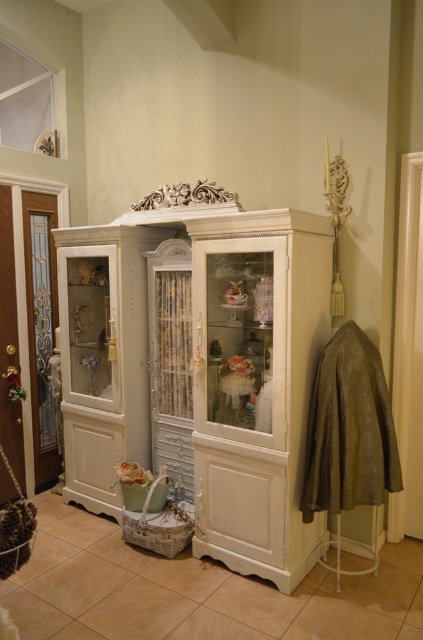
You are standing in the room and want to place a new decorative item on the white glossy cabinet at center. Given that the cabinet is positioned at coordinates approximately 0.580 in the x and 0.478 in the y direction, can you determine its central location relative to the room?

The white glossy cabinet at center is located at point (x=202, y=371), so its central position in the room can be determined using these coordinates.

You are a delivery person who needs to place a package that is 3 feet long between the white glossy cabinet at center and the translucent glass door at left. Can you fit the package between them without moving either object?

The distance between the white glossy cabinet at center and the translucent glass door at left is 3.46 feet. Since the package is 3 feet long, it can fit between them as the space is slightly larger than the package.